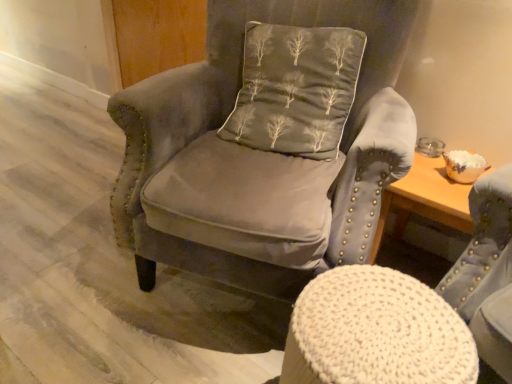
Question: From the image's perspective, is dark gray fabric pillow with tree pattern at center above or below velvet gray armchair at center, which is the first chair in top-to-bottom order?

Choices:
 (A) above
 (B) below

Answer: (A)

Question: Looking at their shapes, would you say dark gray fabric pillow with tree pattern at center is wider or thinner than velvet gray armchair at center, marked as the second chair in a bottom-to-top arrangement?

Choices:
 (A) thin
 (B) wide

Answer: (A)

Question: Which object is the farthest from the dark gray fabric pillow with tree pattern at center?

Choices:
 (A) knitted fabric stool at center, which is the 1th chair from bottom to top
 (B) velvet gray armchair at center, marked as the second chair in a bottom-to-top arrangement

Answer: (A)

Question: Considering the real-world distances, which object is closest to the dark gray fabric pillow with tree pattern at center?

Choices:
 (A) velvet gray armchair at center, marked as the second chair in a bottom-to-top arrangement
 (B) knitted fabric stool at center, which ranks as the 2th chair in top-to-bottom order

Answer: (A)